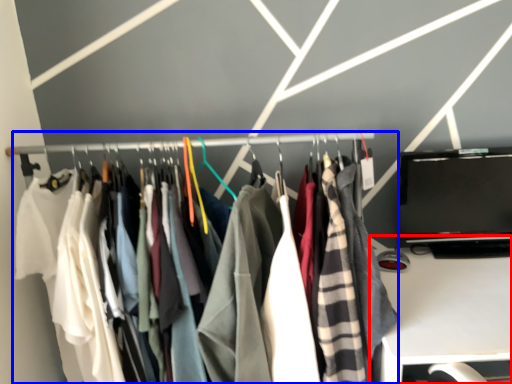
Question: Which of the following is the closest to the observer, furniture (highlighted by a red box) or closet (highlighted by a blue box)?

Choices:
 (A) furniture
 (B) closet

Answer: (A)